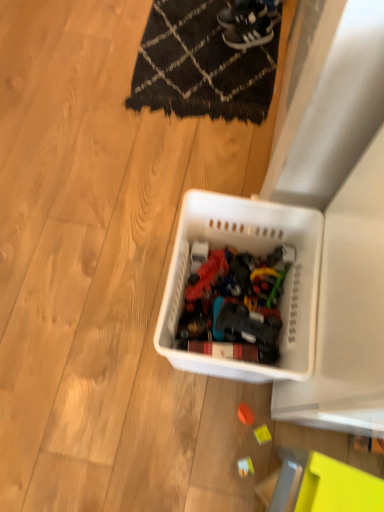
Question: Does black suede sneakers at upper center, placed as the second footwear when sorted from bottom to top, appear on the right side of orange matte ball at center, which ranks as the 1th toy in top-to-bottom order?

Choices:
 (A) no
 (B) yes

Answer: (B)

Question: Considering the relative sizes of black suede sneakers at upper center, acting as the 1th footwear starting from the top, and orange matte ball at center, acting as the 3th toy starting from the bottom, in the image provided, is black suede sneakers at upper center, acting as the 1th footwear starting from the top, bigger than orange matte ball at center, acting as the 3th toy starting from the bottom,?

Choices:
 (A) no
 (B) yes

Answer: (B)

Question: Is orange matte ball at center, which ranks as the 1th toy in top-to-bottom order, located within black suede sneakers at upper center, placed as the second footwear when sorted from bottom to top?

Choices:
 (A) no
 (B) yes

Answer: (A)

Question: Is black suede sneakers at upper center, placed as the second footwear when sorted from bottom to top, far away from orange matte ball at center, acting as the 3th toy starting from the bottom?

Choices:
 (A) no
 (B) yes

Answer: (B)

Question: Could you tell me if black suede sneakers at upper center, acting as the 1th footwear starting from the top, is facing orange matte ball at center, acting as the 3th toy starting from the bottom?

Choices:
 (A) no
 (B) yes

Answer: (A)

Question: Is black suede sneakers at upper center, placed as the second footwear when sorted from bottom to top, shorter than orange matte ball at center, acting as the 3th toy starting from the bottom?

Choices:
 (A) yes
 (B) no

Answer: (B)

Question: Is white leather sneakers at upper center, the first footwear from the bottom, thinner than orange matte ball at center, acting as the 3th toy starting from the bottom?

Choices:
 (A) no
 (B) yes

Answer: (A)

Question: Is white leather sneakers at upper center, which is the second footwear from top to bottom, wider than orange matte ball at center, which ranks as the 1th toy in top-to-bottom order?

Choices:
 (A) yes
 (B) no

Answer: (A)

Question: Is white leather sneakers at upper center, which is the second footwear from top to bottom, located outside orange matte ball at center, acting as the 3th toy starting from the bottom?

Choices:
 (A) yes
 (B) no

Answer: (A)

Question: Is white leather sneakers at upper center, the first footwear from the bottom, bigger than orange matte ball at center, which ranks as the 1th toy in top-to-bottom order?

Choices:
 (A) no
 (B) yes

Answer: (B)

Question: Does white leather sneakers at upper center, which is the second footwear from top to bottom, have a greater height compared to orange matte ball at center, which ranks as the 1th toy in top-to-bottom order?

Choices:
 (A) yes
 (B) no

Answer: (A)

Question: Is white leather sneakers at upper center, the first footwear from the bottom, not close to orange matte ball at center, acting as the 3th toy starting from the bottom?

Choices:
 (A) no
 (B) yes

Answer: (B)

Question: Is black woven mat at upper center oriented towards white plastic toy at lower center, which ranks as the 1th toy in bottom-to-top order?

Choices:
 (A) no
 (B) yes

Answer: (A)